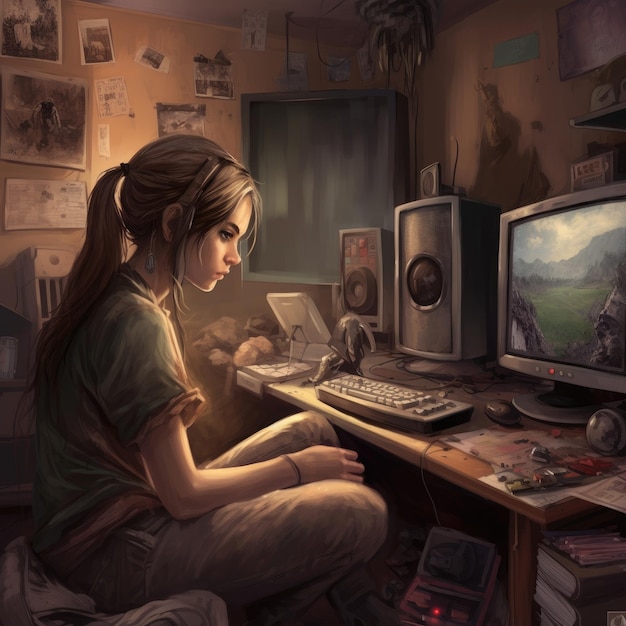
Where is `book`? book is located at coordinates (553, 578), (558, 601), (551, 621).